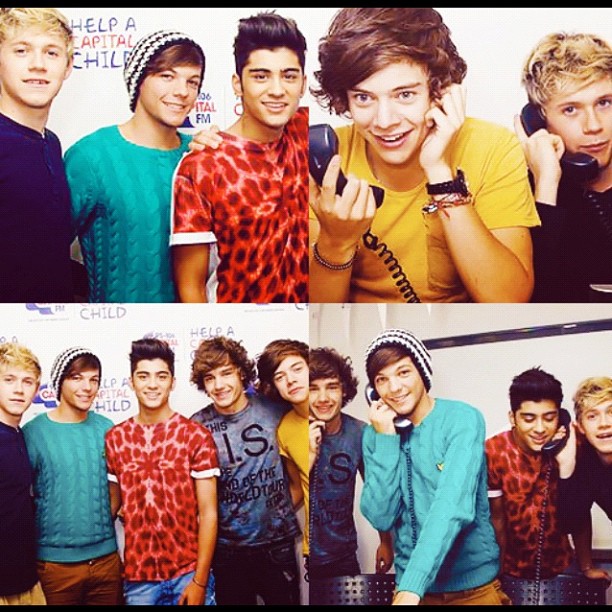
This screenshot has width=612, height=612. I want to click on telephone receiver, so click(x=553, y=448), click(x=323, y=142), click(x=578, y=168).